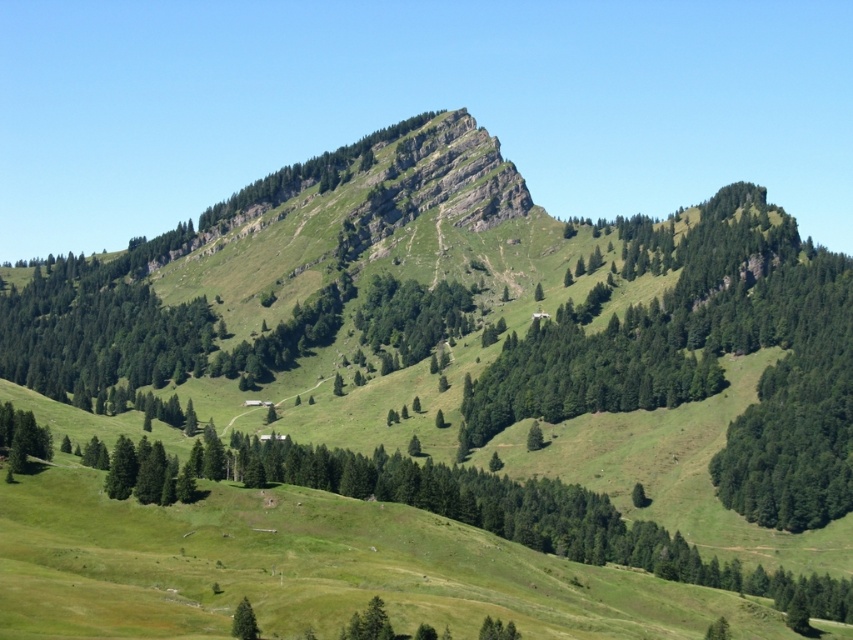
You are a hiker navigating the mountain trail and want to reach the cabin located at point (257, 630). There is another point at (405, 326) further along your path. Which point should you approach first?

You should approach point (257, 630) first because it is closer to your current position than point (405, 326), which is further away.

You are hiking on the mountain and want to take a photo of the green leafy tree at center and the green matte tree at lower center. Which tree should you move closer to in order to get both trees in the same frame without zooming?

You should move closer to the green leafy tree at center because it is closer to you than the green matte tree at lower center, so bringing it nearer will help align both trees within the frame.